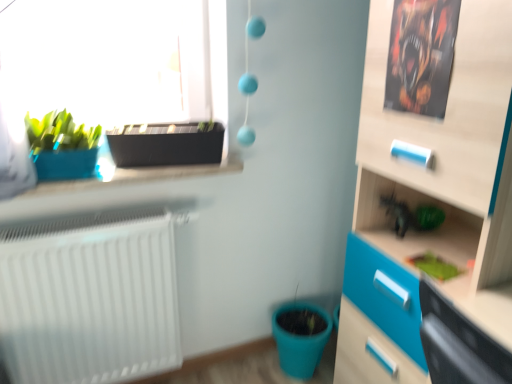
Question: Does black plastic flowerpot at upper left, the first flowerpot viewed from the top, turn towards matte plastic flowerpot at lower center, which is counted as the first flowerpot, starting from the right?

Choices:
 (A) yes
 (B) no

Answer: (B)

Question: Considering the relative sizes of black plastic flowerpot at upper left, arranged as the second flowerpot when viewed from the back, and matte plastic flowerpot at lower center, the second flowerpot in the top-to-bottom sequence, in the image provided, is black plastic flowerpot at upper left, arranged as the second flowerpot when viewed from the back, wider than matte plastic flowerpot at lower center, the second flowerpot in the top-to-bottom sequence,?

Choices:
 (A) no
 (B) yes

Answer: (A)

Question: Is matte plastic flowerpot at lower center, the second flowerpot positioned from the left, at the back of black plastic flowerpot at upper left, which is counted as the 1th flowerpot, starting from the front?

Choices:
 (A) no
 (B) yes

Answer: (A)

Question: Is the position of black plastic flowerpot at upper left, the first flowerpot in the left-to-right sequence, more distant than that of matte plastic flowerpot at lower center, the second flowerpot in the top-to-bottom sequence?

Choices:
 (A) no
 (B) yes

Answer: (A)

Question: Is black plastic flowerpot at upper left, the second flowerpot in the bottom-to-top sequence, far away from matte plastic flowerpot at lower center, which is counted as the first flowerpot, starting from the right?

Choices:
 (A) yes
 (B) no

Answer: (B)

Question: Is black plastic flowerpot at upper left, arranged as the second flowerpot when viewed from the back, in front of or behind green matte plant at lower right in the image?

Choices:
 (A) front
 (B) behind

Answer: (B)

Question: Is point (179, 157) closer or farther from the camera than point (414, 264)?

Choices:
 (A) closer
 (B) farther

Answer: (B)

Question: From a real-world perspective, is black plastic flowerpot at upper left, the first flowerpot viewed from the top, above or below green matte plant at lower right?

Choices:
 (A) above
 (B) below

Answer: (A)

Question: From the image's perspective, is black plastic flowerpot at upper left, placed as the 2th flowerpot when sorted from right to left, positioned above or below green matte plant at lower right?

Choices:
 (A) below
 (B) above

Answer: (B)

Question: Is black plastic flowerpot at upper left, the first flowerpot in the left-to-right sequence, situated inside matte plastic flowerpot at lower center, the 1th flowerpot positioned from the back, or outside?

Choices:
 (A) inside
 (B) outside

Answer: (B)

Question: Relative to matte plastic flowerpot at lower center, the 1th flowerpot positioned from the back, is black plastic flowerpot at upper left, which is counted as the 1th flowerpot, starting from the front, in front or behind?

Choices:
 (A) front
 (B) behind

Answer: (A)

Question: Does point (193, 122) appear closer or farther from the camera than point (314, 340)?

Choices:
 (A) closer
 (B) farther

Answer: (A)

Question: From the image's perspective, is black plastic flowerpot at upper left, placed as the 2th flowerpot when sorted from right to left, located above or below matte plastic flowerpot at lower center, the second flowerpot in the top-to-bottom sequence?

Choices:
 (A) below
 (B) above

Answer: (B)

Question: In terms of size, does matte plastic flowerpot at lower center, the second flowerpot in the top-to-bottom sequence, appear bigger or smaller than green matte plant at lower right?

Choices:
 (A) big
 (B) small

Answer: (A)

Question: From the image's perspective, is matte plastic flowerpot at lower center, the second flowerpot positioned from the left, located above or below green matte plant at lower right?

Choices:
 (A) above
 (B) below

Answer: (B)